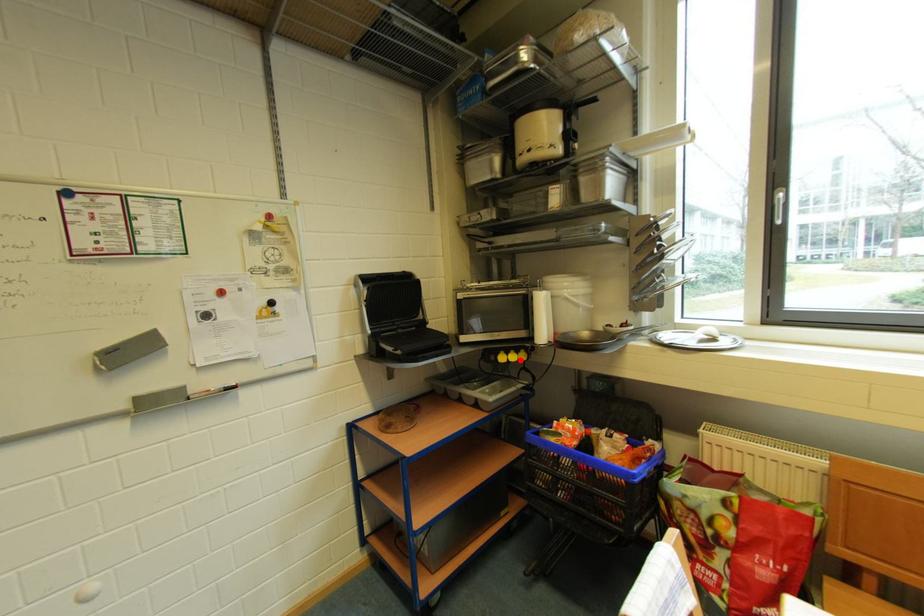
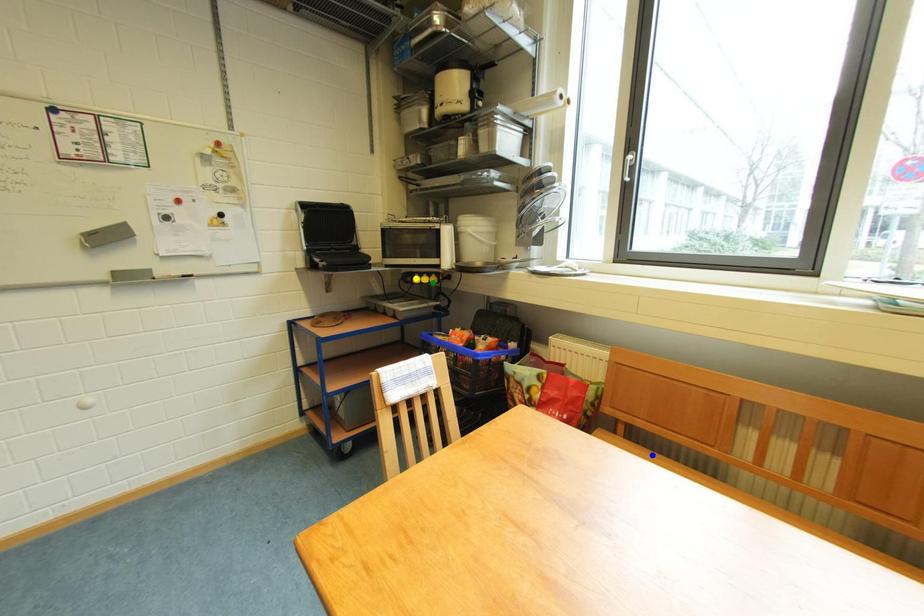
Question: I am providing you with two images of the same scene from different viewpoints. A red point is marked on the first image. You are given multiple points on the second image. Which point in image 2 represents the same 3d spot as the red point in image 1?

Choices:
 (A) green point
 (B) blue point
 (C) yellow point

Answer: (A)